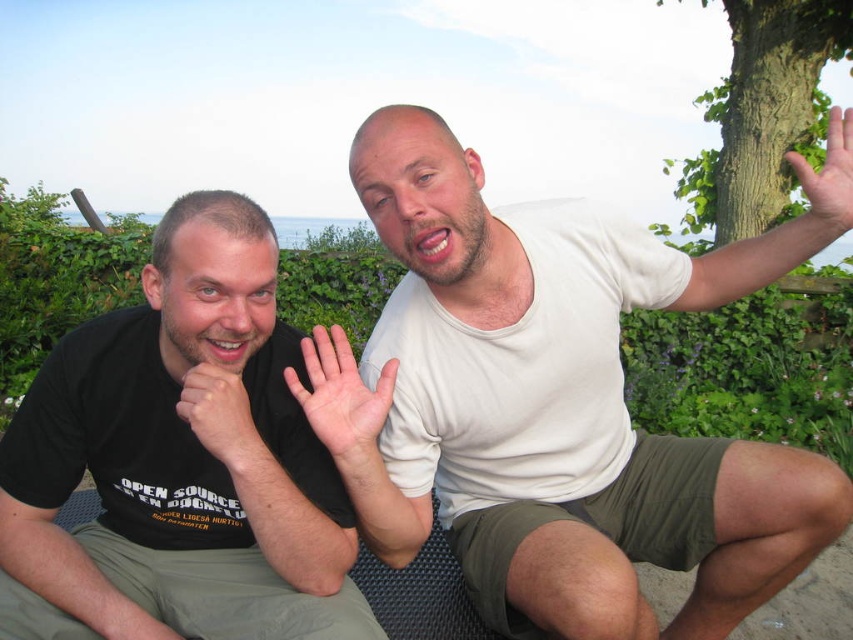
Does black matte shirt at left lie behind matte black hand at lower left?

No, it is not.

Is black matte shirt at left bigger than matte black hand at lower left?

Correct, black matte shirt at left is larger in size than matte black hand at lower left.

You are a GUI agent. You are given a task and a screenshot of the screen. Output one action in this format:
    pyautogui.click(x=<x>, y=<y>)
    Task: Click on the black matte shirt at left
    
    Given the screenshot: What is the action you would take?
    pyautogui.click(x=177, y=464)

Which is more to the left, light skin smooth hand at center or matte black hand at lower left?

matte black hand at lower left

Between point (349, 365) and point (222, 384), which one is positioned in front?

Point (222, 384) is more forward.

Identify the location of light skin smooth hand at center. This screenshot has height=640, width=853. (341, 396).

Does black matte shirt at left have a lesser width compared to light brown skin at upper right?

In fact, black matte shirt at left might be wider than light brown skin at upper right.

Is black matte shirt at left shorter than light brown skin at upper right?

Incorrect, black matte shirt at left's height does not fall short of light brown skin at upper right's.

Does point (119, 497) come closer to viewer compared to point (836, 154)?

Yes, it is in front of point (836, 154).

Where is `black matte shirt at left`? Image resolution: width=853 pixels, height=640 pixels. black matte shirt at left is located at coordinates (177, 464).